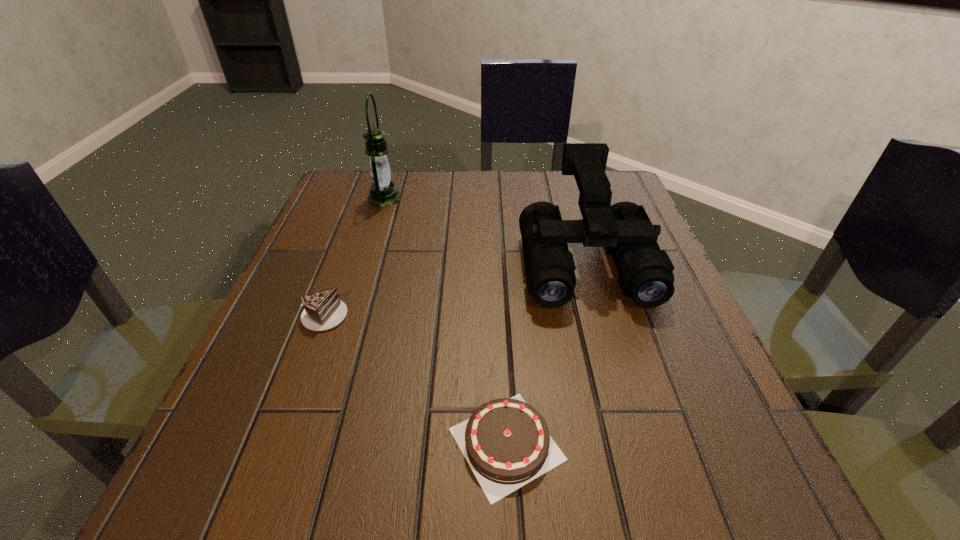
Identify the location of blank space at the near edge of the desktop. The image size is (960, 540). (561, 503).

The image size is (960, 540). Find the location of `vacant space at the left edge of the desktop`. vacant space at the left edge of the desktop is located at coordinates (336, 276).

The image size is (960, 540). Find the location of `free location at the right edge of the desktop`. free location at the right edge of the desktop is located at coordinates (594, 298).

This screenshot has width=960, height=540. Find the location of `vacant space at the far left corner of the desktop`. vacant space at the far left corner of the desktop is located at coordinates (341, 170).

The height and width of the screenshot is (540, 960). In the image, there is a desktop. What are the coordinates of `free space at the near left corner` in the screenshot? It's located at (324, 459).

The width and height of the screenshot is (960, 540). I want to click on free spot at the near right corner of the desktop, so click(x=740, y=490).

The width and height of the screenshot is (960, 540). Find the location of `unoccupied position between the taller chocolate cake and the binoculars`. unoccupied position between the taller chocolate cake and the binoculars is located at coordinates (454, 287).

Where is `empty location between the farther chocolate cake and the tallest object`? This screenshot has height=540, width=960. empty location between the farther chocolate cake and the tallest object is located at coordinates (354, 256).

This screenshot has width=960, height=540. I want to click on free spot between the binoculars and the third tallest object, so click(454, 287).

I want to click on free point between the farthest object and the binoculars, so click(x=485, y=229).